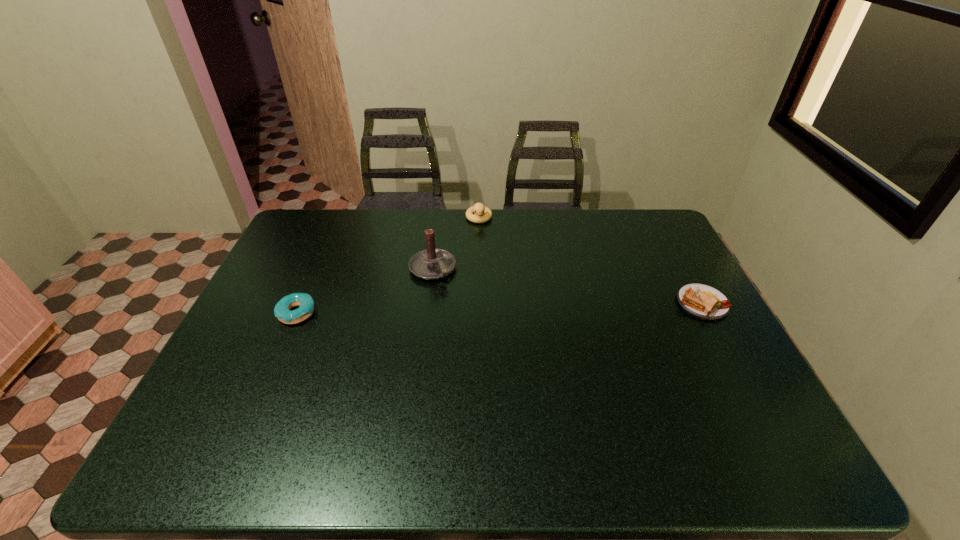
Find the location of a particular element. doughnut is located at coordinates (282, 311).

Identify the location of sandwich. (702, 301).

The height and width of the screenshot is (540, 960). Identify the location of candle. (432, 263).

Find the location of a particular element. the second farthest object is located at coordinates click(432, 263).

Locate an element on the screen. Image resolution: width=960 pixels, height=540 pixels. the third object from left to right is located at coordinates (478, 208).

This screenshot has height=540, width=960. In order to click on the third shortest object in this screenshot , I will do `click(478, 208)`.

Where is `vacant space located on the back of the leftmost object`? Image resolution: width=960 pixels, height=540 pixels. vacant space located on the back of the leftmost object is located at coordinates (311, 281).

Locate an element on the screen. The height and width of the screenshot is (540, 960). vacant area situated on the front of the rightmost object is located at coordinates (721, 338).

Where is `vacant region located on the side of the third nearest object with the handle loop`? vacant region located on the side of the third nearest object with the handle loop is located at coordinates (497, 355).

You are a GUI agent. You are given a task and a screenshot of the screen. Output one action in this format:
    pyautogui.click(x=<x>, y=<y>)
    Task: Click on the free spot located on the side of the third nearest object with the handle loop
    Image resolution: width=960 pixels, height=540 pixels.
    Given the screenshot: What is the action you would take?
    pyautogui.click(x=509, y=372)